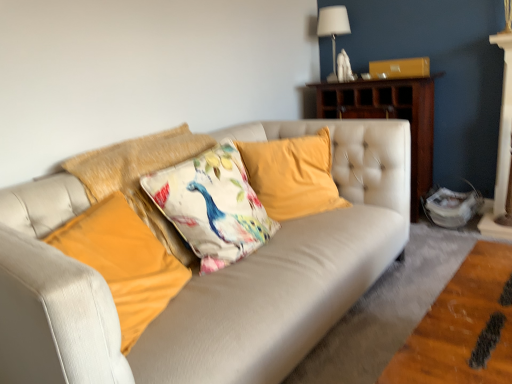
Question: Does white fabric lampshade at upper right have a greater width compared to velvet orange pillow at center, the 1th pillow positioned from the left?

Choices:
 (A) yes
 (B) no

Answer: (B)

Question: Can you confirm if white fabric lampshade at upper right is shorter than velvet orange pillow at center, which ranks as the 4th pillow in right-to-left order?

Choices:
 (A) no
 (B) yes

Answer: (A)

Question: From the image's perspective, would you say white fabric lampshade at upper right is shown under velvet orange pillow at center, the 1th pillow positioned from the left?

Choices:
 (A) no
 (B) yes

Answer: (A)

Question: Is velvet orange pillow at center, which ranks as the 4th pillow in right-to-left order, inside white fabric lampshade at upper right?

Choices:
 (A) yes
 (B) no

Answer: (B)

Question: Is white fabric lampshade at upper right oriented towards velvet orange pillow at center, which ranks as the 4th pillow in right-to-left order?

Choices:
 (A) yes
 (B) no

Answer: (A)

Question: From a real-world perspective, is white fabric lampshade at upper right below velvet orange pillow at center, which ranks as the 4th pillow in right-to-left order?

Choices:
 (A) yes
 (B) no

Answer: (B)

Question: From a real-world perspective, is velvet yellow pillow at center, arranged as the first pillow when viewed from the right, over velvet orange pillow at center, the 1th pillow positioned from the left?

Choices:
 (A) no
 (B) yes

Answer: (B)

Question: Does velvet yellow pillow at center, arranged as the first pillow when viewed from the right, contain velvet orange pillow at center, which ranks as the 4th pillow in right-to-left order?

Choices:
 (A) yes
 (B) no

Answer: (B)

Question: From the image's perspective, is velvet yellow pillow at center, arranged as the first pillow when viewed from the right, above velvet orange pillow at center, the 1th pillow positioned from the left?

Choices:
 (A) no
 (B) yes

Answer: (B)

Question: From the image's perspective, is velvet yellow pillow at center, arranged as the first pillow when viewed from the right, under velvet orange pillow at center, the 1th pillow positioned from the left?

Choices:
 (A) yes
 (B) no

Answer: (B)

Question: Considering the relative positions of velvet yellow pillow at center, which is the fourth pillow from left to right, and velvet orange pillow at center, which ranks as the 4th pillow in right-to-left order, in the image provided, is velvet yellow pillow at center, which is the fourth pillow from left to right, to the left of velvet orange pillow at center, which ranks as the 4th pillow in right-to-left order, from the viewer's perspective?

Choices:
 (A) no
 (B) yes

Answer: (A)

Question: Is velvet yellow pillow at center, which is the fourth pillow from left to right, next to velvet orange pillow at center, the 1th pillow positioned from the left, and touching it?

Choices:
 (A) no
 (B) yes

Answer: (A)

Question: Does floral fabric cushion at center, the 3th pillow viewed from the left, come in front of velvet yellow pillow at center, arranged as the first pillow when viewed from the right?

Choices:
 (A) no
 (B) yes

Answer: (B)